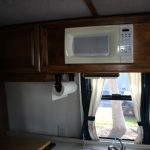
Image resolution: width=150 pixels, height=150 pixels. Identify the location of electrical outlet. (62, 133).